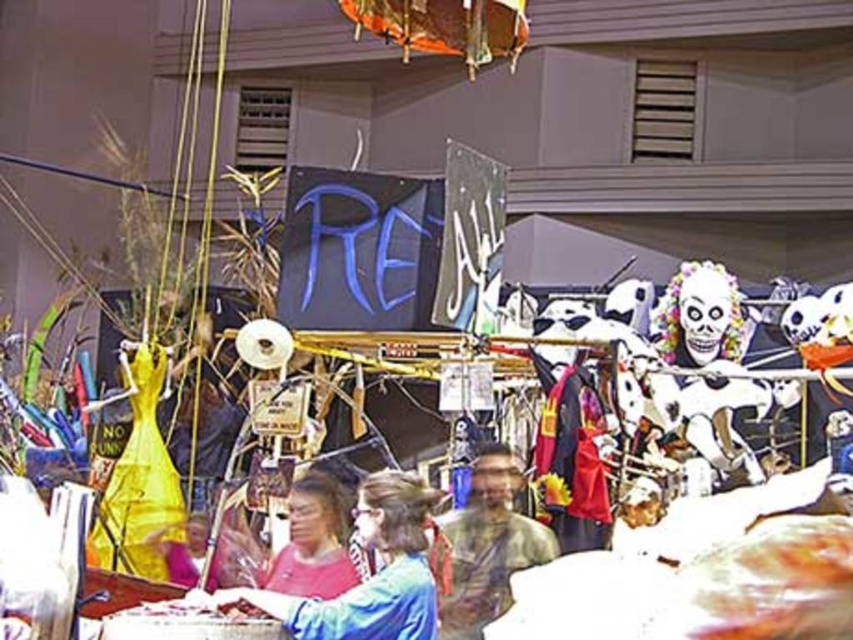
You are a tailor standing in the middle of the room and need to adjust the sleeves of both the blue fabric shirt at center and the matte pink shirt at center. Since you can only work on one shirt at a time, which shirt should you start with to minimize walking distance?

You should start with whichever shirt is closer to you. However, the distance between the blue fabric shirt at center and the matte pink shirt at center is 15.74 inches, so you can choose either one first as the distance between them is relatively small.